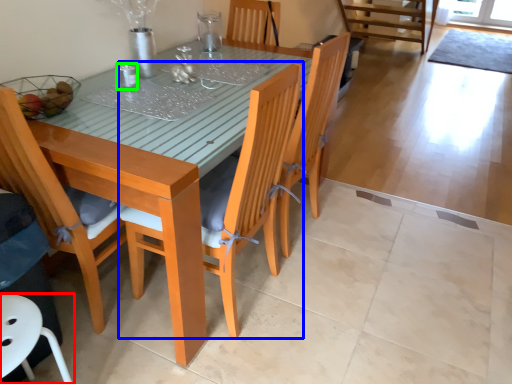
Question: Which is nearer to the chair (highlighted by a red box)? chair (highlighted by a blue box) or tableware (highlighted by a green box).

Choices:
 (A) chair
 (B) tableware

Answer: (A)